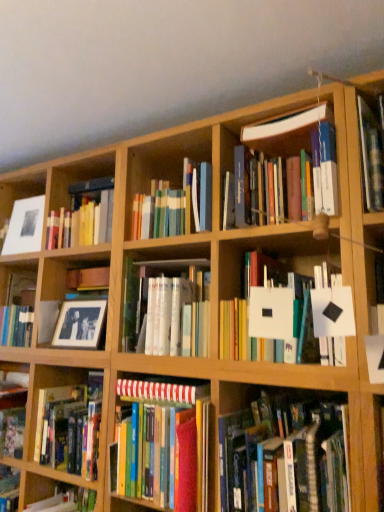
Question: From the image's perspective, is hardcover books at center, acting as the 1th book starting from the top, positioned above or below white matte paper at center, the 2th book when ordered from top to bottom?

Choices:
 (A) below
 (B) above

Answer: (B)

Question: In terms of size, does hardcover books at center, acting as the 6th book starting from the bottom, appear bigger or smaller than white matte paper at center, the 2th book when ordered from top to bottom?

Choices:
 (A) big
 (B) small

Answer: (B)

Question: Estimate the real-world distances between objects in this image. Which object is closer to the striped paper at center, positioned as the fifth book in top-to-bottom order?

Choices:
 (A) matte black picture frame at center-left, positioned as the second picture frame in left-to-right order
 (B) hardcover books at center, acting as the 1th book starting from the top
 (C) black matte photo frame at left
 (D) white glossy book at center, which appears as the fourth book when ordered from the bottom
 (E) hardcover books at center, the sixth book from the top

Answer: (D)

Question: Estimate the real-world distances between objects in this image. Which object is closer to the hardcover books at center, which is counted as the 1th book, starting from the bottom?

Choices:
 (A) white matte paper at center, the 2th book when ordered from top to bottom
 (B) white glossy book at center, which appears as the fourth book when ordered from the bottom
 (C) matte white picture frame at upper left, placed as the second picture frame when sorted from front to back
 (D) black matte photo frame at left
 (E) hardcover books at center, acting as the 1th book starting from the top

Answer: (D)